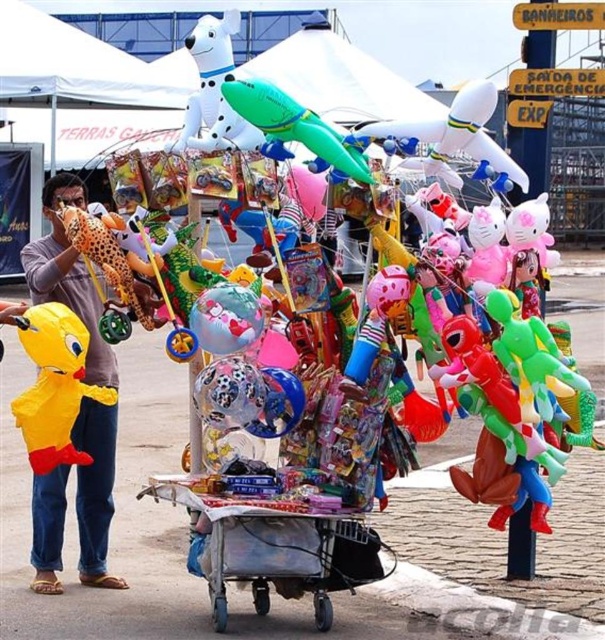
Is metallic silver cart at center above white glossy dog at upper center?

Incorrect, metallic silver cart at center is not positioned above white glossy dog at upper center.

Can you confirm if metallic silver cart at center is thinner than white glossy dog at upper center?

Yes.

I want to click on metallic silver cart at center, so click(276, 547).

Where is `metallic silver cart at center`? This screenshot has height=640, width=605. metallic silver cart at center is located at coordinates tap(276, 547).

Between yellow fabric toy at left and metallic silver cart at center, which one has more height?

yellow fabric toy at left is taller.

Describe the element at coordinates (68, 276) in the screenshot. This screenshot has width=605, height=640. I see `yellow fabric toy at left` at that location.

At what (x,y) coordinates should I click in order to perform the action: click on yellow fabric toy at left. Please return your answer as a coordinate pair (x, y). Looking at the image, I should click on (68, 276).

Which is in front, point (342, 588) or point (22, 340)?

Positioned in front is point (22, 340).

Can you confirm if metallic silver cart at center is positioned above yellow matte rubber duck at left?

Incorrect, metallic silver cart at center is not positioned above yellow matte rubber duck at left.

Does point (258, 547) lie in front of point (76, 320)?

No, (258, 547) is further to viewer.

This screenshot has width=605, height=640. In order to click on metallic silver cart at center in this screenshot , I will do `click(276, 547)`.